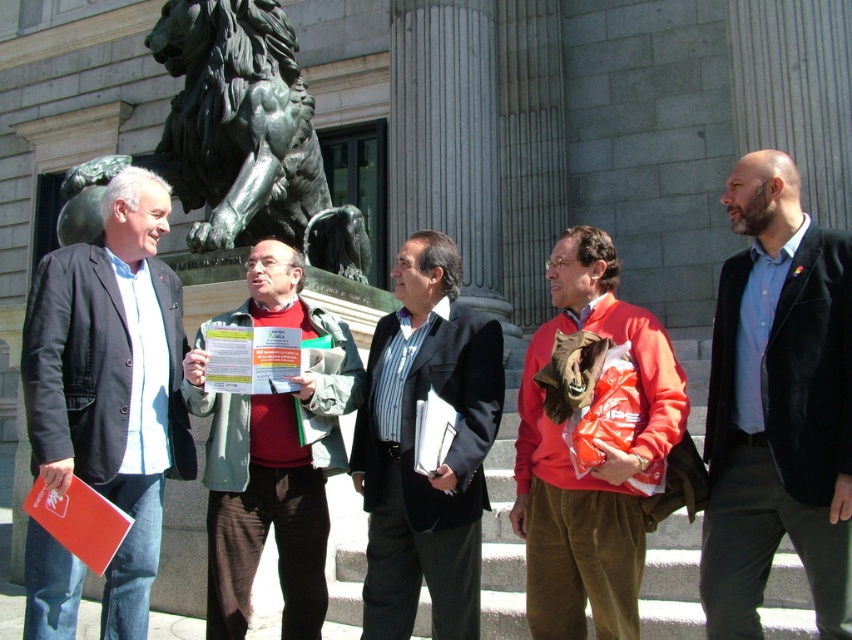
Who is higher up, matte black jacket at left or red sweater at center?

matte black jacket at left is higher up.

Who is taller, matte black jacket at left or red sweater at center?

Standing taller between the two is matte black jacket at left.

The image size is (852, 640). I want to click on matte black jacket at left, so click(112, 381).

Identify the location of matte black jacket at left. This screenshot has height=640, width=852. (112, 381).

This screenshot has width=852, height=640. I want to click on blue cotton shirt at center, so coord(778,406).

Can you confirm if blue cotton shirt at center is thinner than red sweater at center?

Yes, blue cotton shirt at center is thinner than red sweater at center.

Which is in front, point (795, 317) or point (312, 456)?

Point (795, 317) is in front.

I want to click on blue cotton shirt at center, so click(778, 406).

Can you confirm if blue cotton shirt at center is positioned to the right of orange cotton sweater at center?

Correct, you'll find blue cotton shirt at center to the right of orange cotton sweater at center.

Who is positioned more to the right, blue cotton shirt at center or orange cotton sweater at center?

Positioned to the right is blue cotton shirt at center.

The width and height of the screenshot is (852, 640). I want to click on blue cotton shirt at center, so click(x=778, y=406).